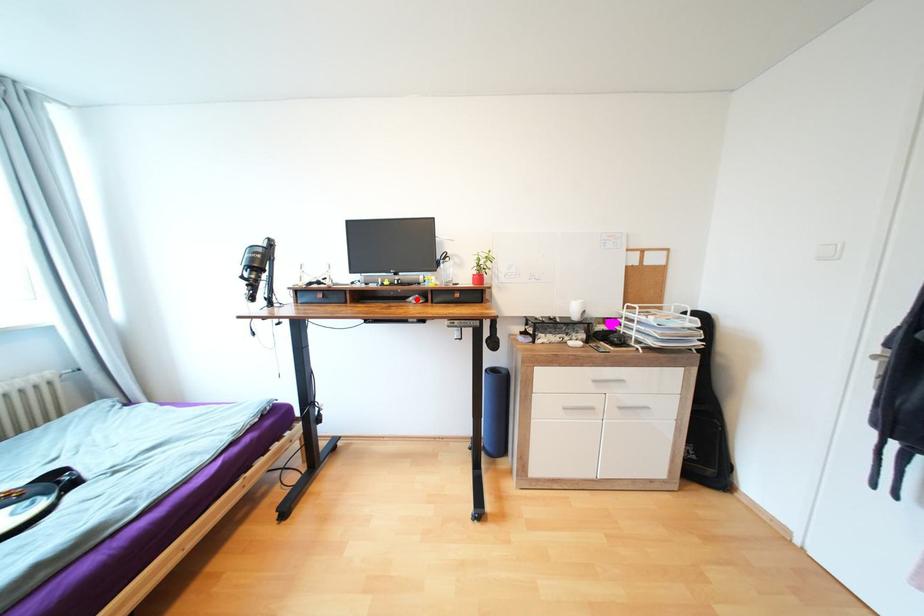
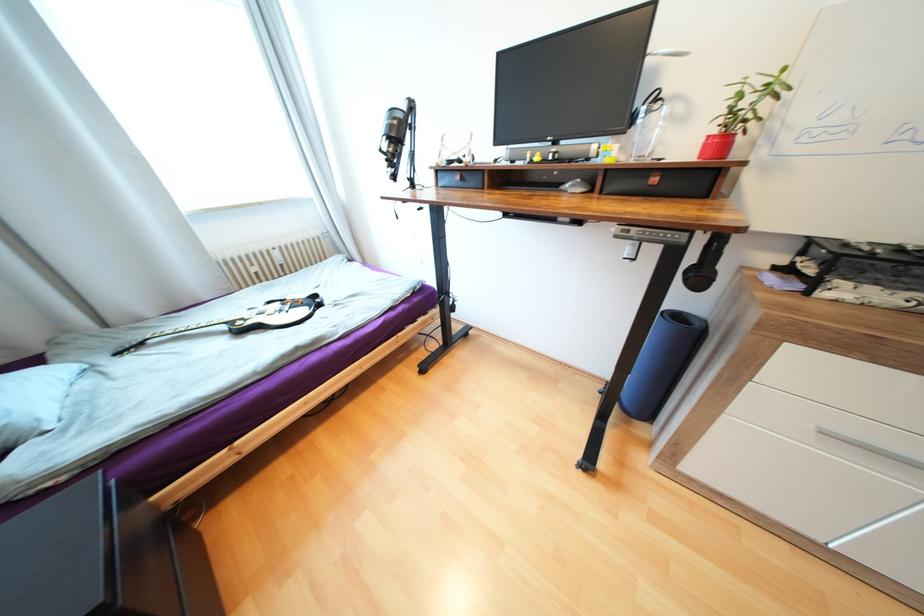
Question: I am providing you with two images of the same scene from different viewpoints. Given a red point in image1, look at the same physical point in image2. Is it:

Choices:
 (A) Closer to the viewpoint
 (B) Farther from the viewpoint

Answer: (A)